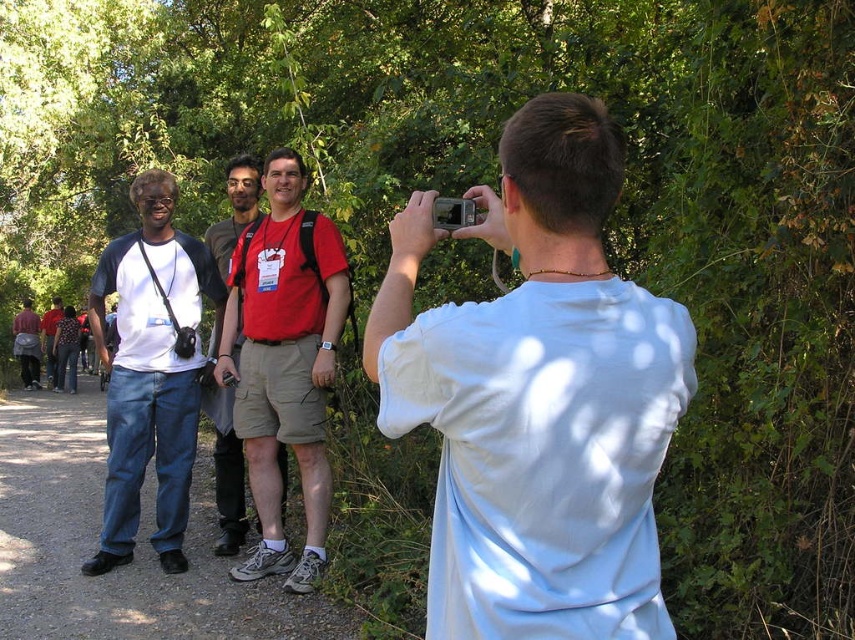
Is white matte shirt at upper right taller than red fabric shirt at center?

In fact, white matte shirt at upper right may be shorter than red fabric shirt at center.

Which is more to the right, white matte shirt at upper right or red fabric shirt at center?

white matte shirt at upper right

Is point (517, 620) positioned before point (211, 244)?

Yes, it is in front of point (211, 244).

The width and height of the screenshot is (855, 640). Identify the location of white matte shirt at upper right. (538, 397).

Can you confirm if red cotton t-shirt at center is taller than denim jeans at left?

Yes, red cotton t-shirt at center is taller than denim jeans at left.

Is red cotton t-shirt at center bigger than denim jeans at left?

Yes, red cotton t-shirt at center is bigger than denim jeans at left.

Find the location of a particular element. Image resolution: width=855 pixels, height=640 pixels. red cotton t-shirt at center is located at coordinates (284, 362).

This screenshot has width=855, height=640. I want to click on red cotton t-shirt at center, so click(x=284, y=362).

Who is positioned more to the right, red cotton t-shirt at center or red fabric shirt at center?

From the viewer's perspective, red cotton t-shirt at center appears more on the right side.

Is red cotton t-shirt at center to the right of red fabric shirt at center from the viewer's perspective?

Correct, you'll find red cotton t-shirt at center to the right of red fabric shirt at center.

Is point (273, 314) positioned behind point (208, 404)?

No, (273, 314) is in front of (208, 404).

Identify the location of red cotton t-shirt at center. This screenshot has height=640, width=855. (284, 362).